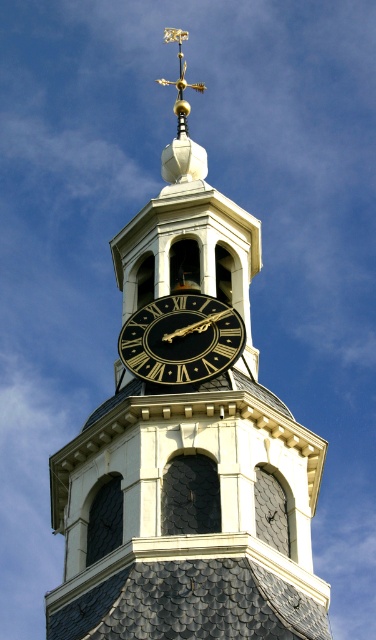
You are a maintenance worker needing to reach both the black clock tower at center and the black polished clock at center for inspection. Given that your ladder can extend up to 15 meters, can you safely inspect both objects without needing a taller ladder?

The distance between the black clock tower at center and the black polished clock at center is 16.39 meters. Since your ladder only extends up to 15 meters, you cannot safely reach both objects with the current ladder length.

You are standing in front of the clock tower and want to take a photo of the black clock tower at center and the black polished clock at center. If you want to capture both objects in the frame, which one should you position closer to the camera to ensure both are fully visible?

You should position the black polished clock at center closer to the camera because the black clock tower at center is to the left of it, so adjusting the camera angle or moving closer to the black polished clock at center will help include both in the frame.

You are standing in front of the clock tower and want to touch the two points on the clock face. Which point, point (x=174, y=429) or point (x=195, y=374), will require you to reach out less distance?

Point (x=174, y=429) is closer to the camera than point (x=195, y=374), so you will need to reach out less distance to touch point (x=174, y=429).